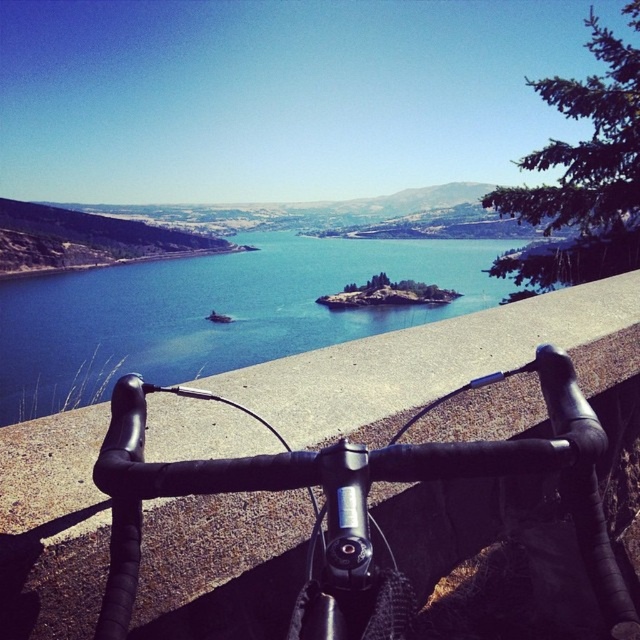
You are riding a bike and looking at the scene. There are two points in the image, point (35, 304) and point (291, 460). Which point is closer to you?

Point (35, 304) is further to the camera than point (291, 460), so the point closer to you is point (291, 460).

Based on the scene description, where exactly is the blue water at center located in terms of coordinates?

The blue water at center is located at coordinates point (216, 308).